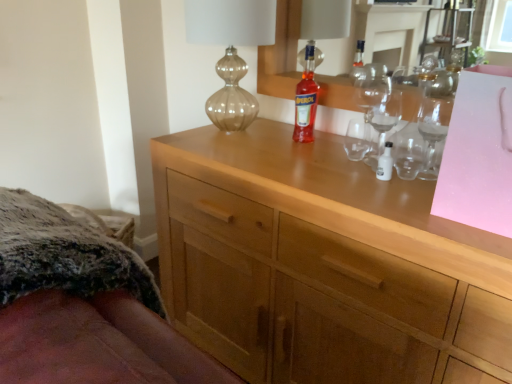
Find the location of a particular element. free space in front of translucent glass vase at upper center is located at coordinates click(244, 156).